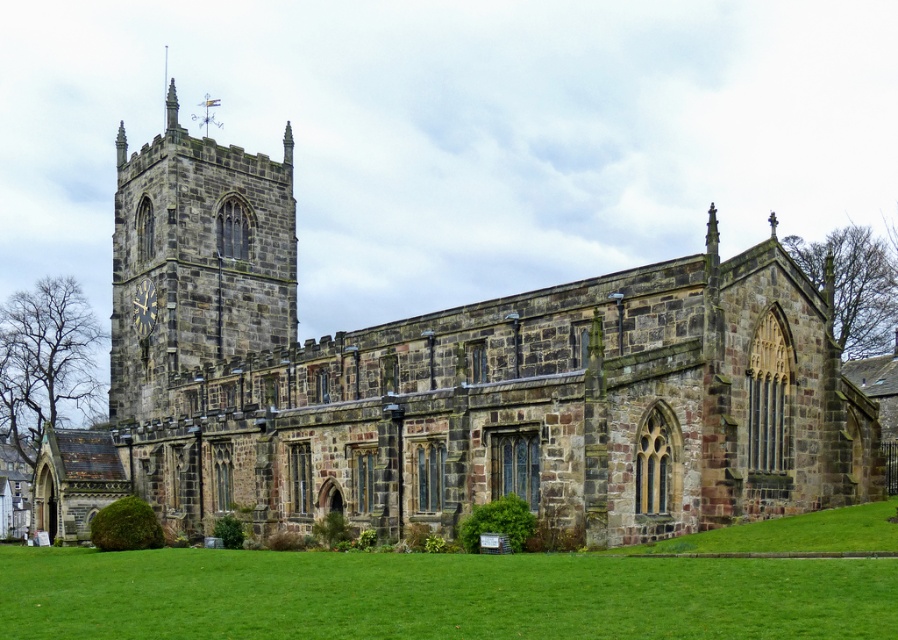
You are an architect visiting the historic stone church and notice the stone clock tower at upper left and the metallic gold clock at left. Which of these two objects is bigger in size?

The stone clock tower at upper left is larger in size compared to the metallic gold clock at left according to the description.

You are standing in front of the historic stone church and want to determine the relative positions of two points marked on the facade. Which point is closer to you, point (249, 275) or point (138, 314)?

Point (249, 275) is further to the viewer than point (138, 314), so point (138, 314) is closer to you.